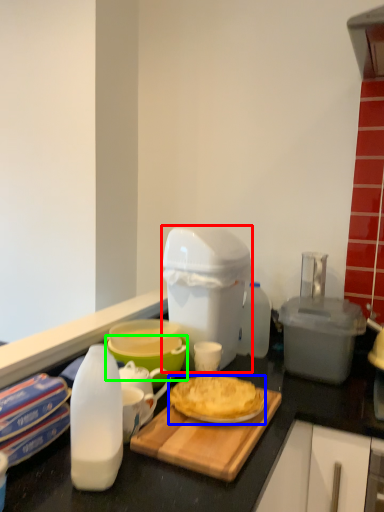
Question: Which object is positioned closest to appliance (highlighted by a red box)? Select from dessert (highlighted by a blue box) and bowl (highlighted by a green box).

Choices:
 (A) dessert
 (B) bowl

Answer: (B)